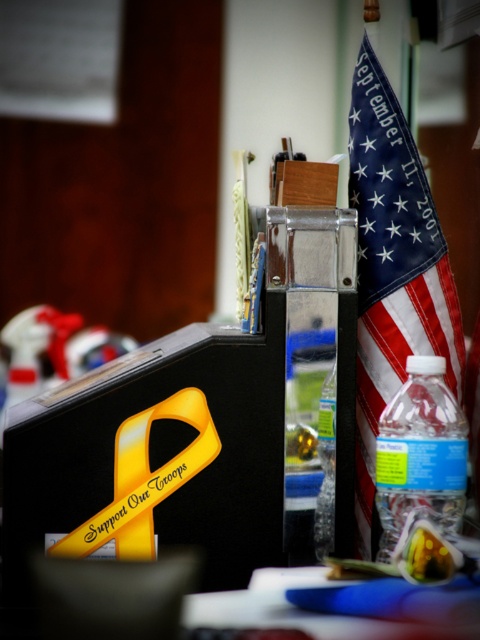
Is blue plastic folder at lower center shorter than clear plastic bottle at center-right?

Correct, blue plastic folder at lower center is not as tall as clear plastic bottle at center-right.

Does point (250, 593) come closer to viewer compared to point (331, 387)?

Yes.

Measure the distance between point [267,586] and camera.

Point [267,586] and camera are 27.61 inches apart from each other.

Identify the location of blue plastic folder at lower center. The width and height of the screenshot is (480, 640). [333, 605].

Is blue fabric flag at right further to the viewer compared to blue plastic folder at lower center?

Yes, it is behind blue plastic folder at lower center.

Can you confirm if blue fabric flag at right is smaller than blue plastic folder at lower center?

No.

Does point (367, 330) come farther from viewer compared to point (283, 596)?

Yes.

Identify the location of blue fabric flag at right. Image resolution: width=480 pixels, height=640 pixels. (393, 272).

Does point (406, 280) come closer to viewer compared to point (319, 525)?

No.

Is point (446, 321) positioned in front of point (322, 428)?

No, it is behind (322, 428).

Where is `blue fabric flag at right`? blue fabric flag at right is located at coordinates (393, 272).